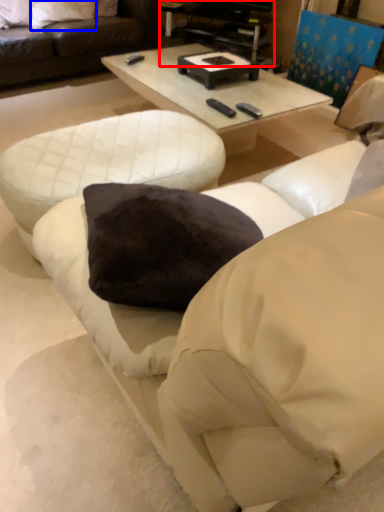
Question: Which object is further to the camera taking this photo, entertainment center (highlighted by a red box) or pillow (highlighted by a blue box)?

Choices:
 (A) entertainment center
 (B) pillow

Answer: (B)